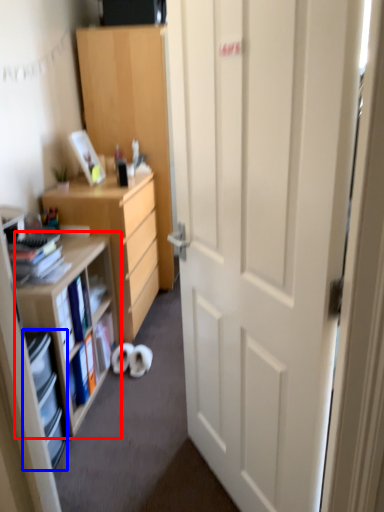
Question: Which of the following is the farthest to the observer, shelf (highlighted by a red box) or shelf (highlighted by a blue box)?

Choices:
 (A) shelf
 (B) shelf

Answer: (A)